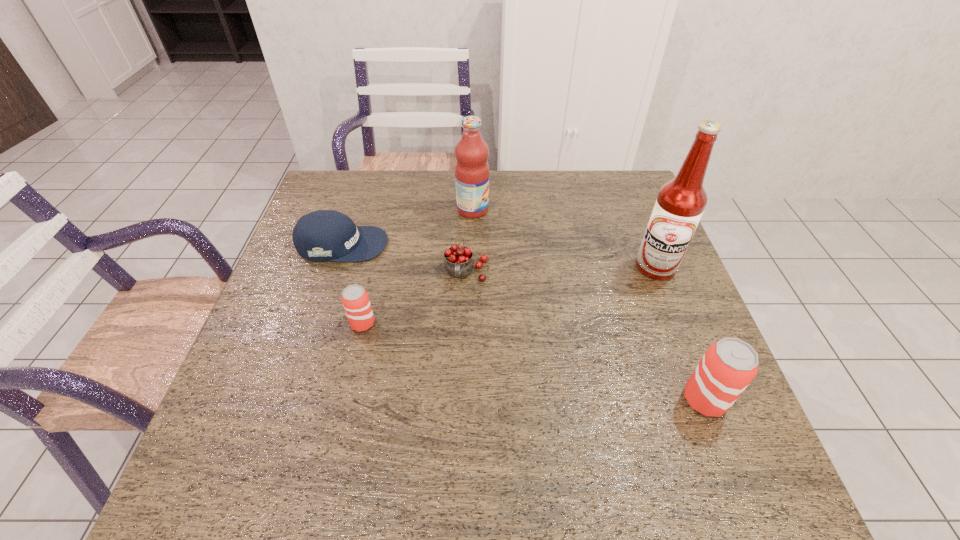
If equal spacing is the goal by inserting an additional beer_can among them, please point out a vacant space for this new beer_can. Please provide its 2D coordinates. Your answer should be formatted as a tuple, i.e. [(x, y)], where the tuple contains the x and y coordinates of a point satisfying the conditions above.

[(521, 359)]